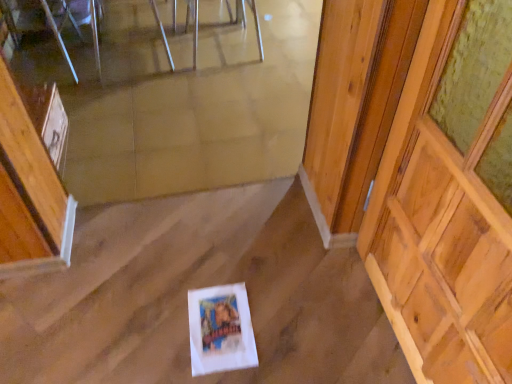
How much space does metallic silver chair at upper center, which is the second chair in right-to-left order, occupy vertically?

metallic silver chair at upper center, which is the second chair in right-to-left order, is 16.45 inches in height.

What is the approximate width of wooden at right?

The width of wooden at right is 11.16 centimeters.

I want to click on wooden at right, so click(449, 199).

Locate an element on the screen. The height and width of the screenshot is (384, 512). metallic silver chair at upper center, which is the second chair in right-to-left order is located at coordinates (96, 29).

Locate an element on the screen. The height and width of the screenshot is (384, 512). chair that is the 2nd object located behind the wooden at right is located at coordinates (245, 20).

From the picture: Is wooden at right to the left of metallic reflective chair at upper center, which is the 2th chair in left-to-right order, from the viewer's perspective?

In fact, wooden at right is to the right of metallic reflective chair at upper center, which is the 2th chair in left-to-right order.

Looking at this image, could you tell me if wooden at right is turned towards metallic reflective chair at upper center, which is the 2th chair in left-to-right order?

No, wooden at right is not turned towards metallic reflective chair at upper center, which is the 2th chair in left-to-right order.

Would you say wooden at right contains metallic reflective chair at upper center, which is the 2th chair in left-to-right order?

Definitely not — metallic reflective chair at upper center, which is the 2th chair in left-to-right order, is not inside wooden at right.

Considering the positions of point (244, 6) and point (175, 30), is point (244, 6) closer or farther from the camera than point (175, 30)?

Point (244, 6) is farther from the camera than point (175, 30).

Consider the image. Is metallic reflective chair at upper center, the first chair positioned from the right, bigger than clear glass table at upper center?

No, metallic reflective chair at upper center, the first chair positioned from the right, is not bigger than clear glass table at upper center.

Is metallic reflective chair at upper center, which is the 2th chair in left-to-right order, in front of or behind clear glass table at upper center in the image?

metallic reflective chair at upper center, which is the 2th chair in left-to-right order, is in front of clear glass table at upper center.

From a real-world perspective, is metallic reflective chair at upper center, the first chair positioned from the right, positioned under clear glass table at upper center based on gravity?

Incorrect, from a real-world perspective, metallic reflective chair at upper center, the first chair positioned from the right, is higher than clear glass table at upper center.

Considering the sizes of objects metallic reflective chair at upper center, the first chair positioned from the right, and metallic silver chair at upper center, which is the first chair from left to right, in the image provided, who is thinner, metallic reflective chair at upper center, the first chair positioned from the right, or metallic silver chair at upper center, which is the first chair from left to right,?

metallic reflective chair at upper center, the first chair positioned from the right, is thinner.

Between metallic reflective chair at upper center, which is the 2th chair in left-to-right order, and metallic silver chair at upper center, which is the first chair from left to right, which one has larger size?

metallic silver chair at upper center, which is the first chair from left to right.

Choose the correct answer: Is metallic reflective chair at upper center, which is the 2th chair in left-to-right order, inside metallic silver chair at upper center, which is the first chair from left to right, or outside it?

metallic reflective chair at upper center, which is the 2th chair in left-to-right order, is located beyond the bounds of metallic silver chair at upper center, which is the first chair from left to right.

Considering the sizes of objects metallic reflective chair at upper center, the first chair positioned from the right, and metallic silver chair at upper center, which is the second chair in right-to-left order, in the image provided, who is taller, metallic reflective chair at upper center, the first chair positioned from the right, or metallic silver chair at upper center, which is the second chair in right-to-left order,?

With more height is metallic silver chair at upper center, which is the second chair in right-to-left order.

Image resolution: width=512 pixels, height=384 pixels. I want to click on furniture on the left side of metallic reflective chair at upper center, the first chair positioned from the right, so click(x=53, y=21).

Is point (97, 46) positioned after point (196, 21)?

No, it is not.

Are clear glass table at upper center and metallic reflective chair at upper center, which is the 2th chair in left-to-right order, beside each other?

No, clear glass table at upper center is not beside metallic reflective chair at upper center, which is the 2th chair in left-to-right order.

Is clear glass table at upper center positioned behind metallic reflective chair at upper center, the first chair positioned from the right?

That is True.

Does clear glass table at upper center have a greater height compared to wooden at right?

Incorrect, the height of clear glass table at upper center is not larger of that of wooden at right.

Can you confirm if clear glass table at upper center is positioned to the right of wooden at right?

No, clear glass table at upper center is not to the right of wooden at right.

Measure the distance from clear glass table at upper center to wooden at right.

clear glass table at upper center and wooden at right are 2.24 meters apart from each other.

Are clear glass table at upper center and wooden at right far apart?

Yes.

This screenshot has width=512, height=384. What are the coordinates of `chair that is the 2nd one when counting downward from the clear glass table at upper center (from the image's perspective)` in the screenshot? It's located at (96, 29).

In terms of height, does clear glass table at upper center look taller or shorter compared to metallic silver chair at upper center, which is the second chair in right-to-left order?

In the image, clear glass table at upper center appears to be shorter than metallic silver chair at upper center, which is the second chair in right-to-left order.

Looking at this image, how much distance is there between clear glass table at upper center and metallic silver chair at upper center, which is the second chair in right-to-left order?

The distance of clear glass table at upper center from metallic silver chair at upper center, which is the second chair in right-to-left order, is 6.34 inches.

Does metallic silver chair at upper center, which is the first chair from left to right, turn towards metallic reflective chair at upper center, which is the 2th chair in left-to-right order?

No, metallic silver chair at upper center, which is the first chair from left to right, is not aimed at metallic reflective chair at upper center, which is the 2th chair in left-to-right order.

Is metallic silver chair at upper center, which is the second chair in right-to-left order, to the left or to the right of metallic reflective chair at upper center, which is the 2th chair in left-to-right order, in the image?

metallic silver chair at upper center, which is the second chair in right-to-left order, is positioned on metallic reflective chair at upper center, which is the 2th chair in left-to-right order,'s left side.

Between metallic silver chair at upper center, which is the first chair from left to right, and metallic reflective chair at upper center, the first chair positioned from the right, which one has larger size?

metallic silver chair at upper center, which is the first chair from left to right, is bigger.

Considering the sizes of metallic silver chair at upper center, which is the second chair in right-to-left order, and metallic reflective chair at upper center, which is the 2th chair in left-to-right order, in the image, is metallic silver chair at upper center, which is the second chair in right-to-left order, taller or shorter than metallic reflective chair at upper center, which is the 2th chair in left-to-right order,?

metallic silver chair at upper center, which is the second chair in right-to-left order, is taller than metallic reflective chair at upper center, which is the 2th chair in left-to-right order.

This screenshot has width=512, height=384. I want to click on chair that is the 2nd object located behind the wooden at right, so click(245, 20).

Where is `furniture to the left of metallic reflective chair at upper center, which is the 2th chair in left-to-right order`? This screenshot has height=384, width=512. furniture to the left of metallic reflective chair at upper center, which is the 2th chair in left-to-right order is located at coordinates (53, 21).

Considering their positions, is wooden at right positioned closer to metallic reflective chair at upper center, which is the 2th chair in left-to-right order, than clear glass table at upper center?

clear glass table at upper center lies closer to metallic reflective chair at upper center, which is the 2th chair in left-to-right order, than the other object.

Based on the photo, estimate the real-world distances between objects in this image. Which object is further from metallic silver chair at upper center, which is the second chair in right-to-left order, clear glass table at upper center or wooden at right?

Among the two, wooden at right is located further to metallic silver chair at upper center, which is the second chair in right-to-left order.

When comparing their distances from wooden at right, does metallic silver chair at upper center, which is the second chair in right-to-left order, or clear glass table at upper center seem closer?

Based on the image, metallic silver chair at upper center, which is the second chair in right-to-left order, appears to be nearer to wooden at right.

When comparing their distances from wooden at right, does metallic reflective chair at upper center, the first chair positioned from the right, or clear glass table at upper center seem closer?

metallic reflective chair at upper center, the first chair positioned from the right, is closer to wooden at right.

When comparing their distances from wooden at right, does metallic silver chair at upper center, which is the first chair from left to right, or metallic reflective chair at upper center, which is the 2th chair in left-to-right order, seem closer?

metallic reflective chair at upper center, which is the 2th chair in left-to-right order, is positioned closer to the anchor wooden at right.

From the image, which object appears to be nearer to metallic silver chair at upper center, which is the second chair in right-to-left order, metallic reflective chair at upper center, which is the 2th chair in left-to-right order, or wooden at right?

The object closer to metallic silver chair at upper center, which is the second chair in right-to-left order, is metallic reflective chair at upper center, which is the 2th chair in left-to-right order.

Based on their spatial positions, is wooden at right or clear glass table at upper center closer to metallic silver chair at upper center, which is the first chair from left to right?

Based on the image, clear glass table at upper center appears to be nearer to metallic silver chair at upper center, which is the first chair from left to right.

Considering their positions, is metallic silver chair at upper center, which is the first chair from left to right, positioned further to metallic reflective chair at upper center, which is the 2th chair in left-to-right order, than wooden at right?

wooden at right.

Where is `chair positioned between wooden at right and metallic reflective chair at upper center, the first chair positioned from the right, from near to far`? The height and width of the screenshot is (384, 512). chair positioned between wooden at right and metallic reflective chair at upper center, the first chair positioned from the right, from near to far is located at coordinates (96, 29).

The height and width of the screenshot is (384, 512). I want to click on chair between clear glass table at upper center and metallic reflective chair at upper center, which is the 2th chair in left-to-right order, from left to right, so click(96, 29).